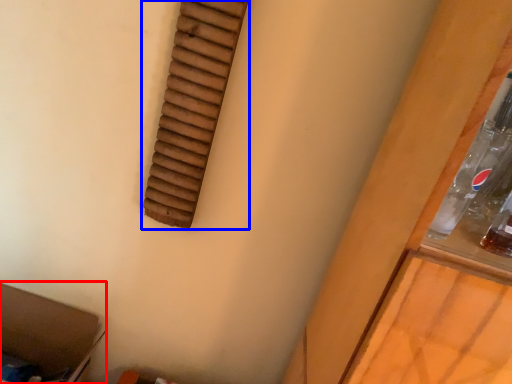
Question: Which point is closer to the camera, storage box (highlighted by a red box) or window (highlighted by a blue box)?

Choices:
 (A) storage box
 (B) window

Answer: (B)